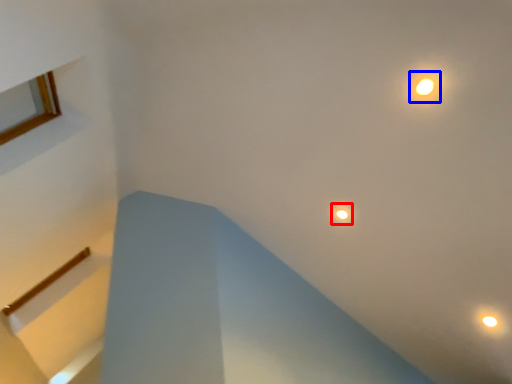
Question: Which point is closer to the camera, droplight (highlighted by a red box) or light (highlighted by a blue box)?

Choices:
 (A) droplight
 (B) light

Answer: (B)